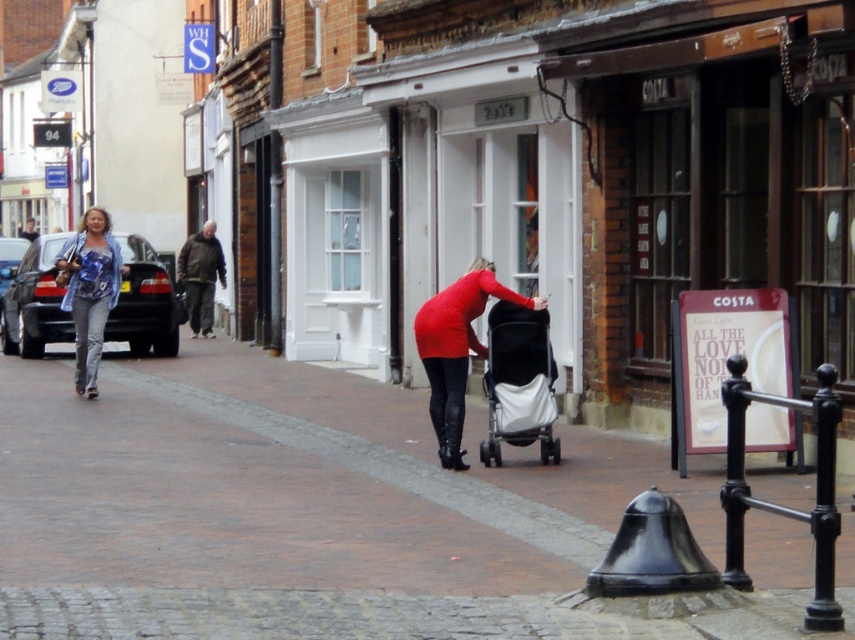
Question: Is matte black car at left bigger than matte red shirt at center?

Choices:
 (A) no
 (B) yes

Answer: (B)

Question: Is brown cobblestone pavement at center in front of black matte baby carriage at center?

Choices:
 (A) no
 (B) yes

Answer: (B)

Question: Which point is farther from the camera taking this photo?

Choices:
 (A) (201, 266)
 (B) (105, 220)

Answer: (A)

Question: Is brown cobblestone pavement at center further to the viewer compared to brown leather jacket at center?

Choices:
 (A) no
 (B) yes

Answer: (A)

Question: Which object appears farthest from the camera in this image?

Choices:
 (A) brown cobblestone pavement at center
 (B) brown leather jacket at center
 (C) brown leather jacket at left
 (D) matte black car at left

Answer: (B)

Question: Which point is farther from the camera taking this photo?

Choices:
 (A) (181, 244)
 (B) (541, 324)

Answer: (A)